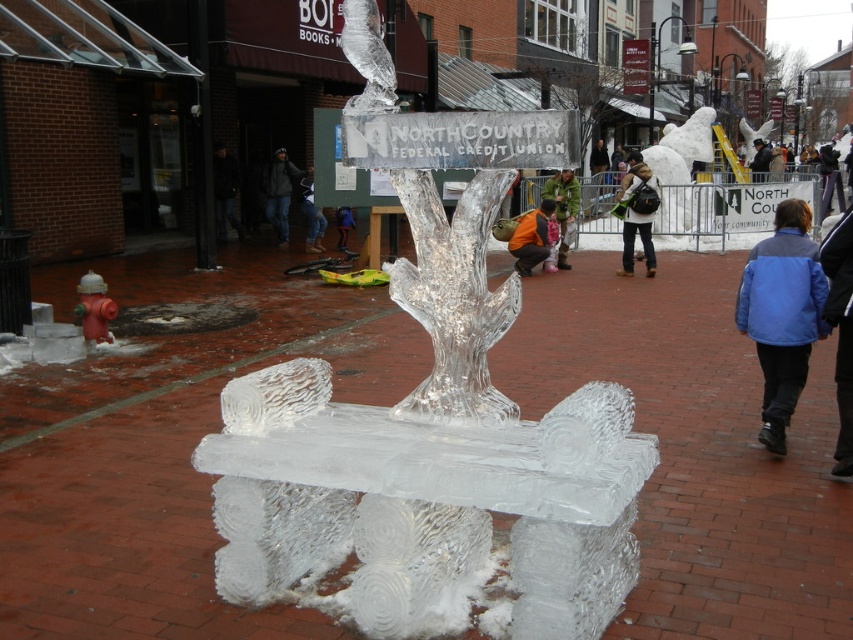
You are standing in the plaza and want to place a small gift box on the ground near the matte gray backpack at center. Where should you place it?

The matte gray backpack at center is located at point 2D coordinates of (636, 214), so place the gift box near those coordinates.